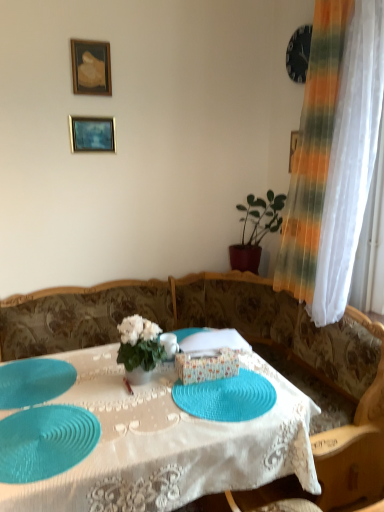
At what (x,y) coordinates should I click in order to perform the action: click on free space above teal woven placemat at center, the 3th glass plate positioned from the left (from a real-world perspective). Please return your answer as a coordinate pair (x, y). The height and width of the screenshot is (512, 384). Looking at the image, I should click on (231, 381).